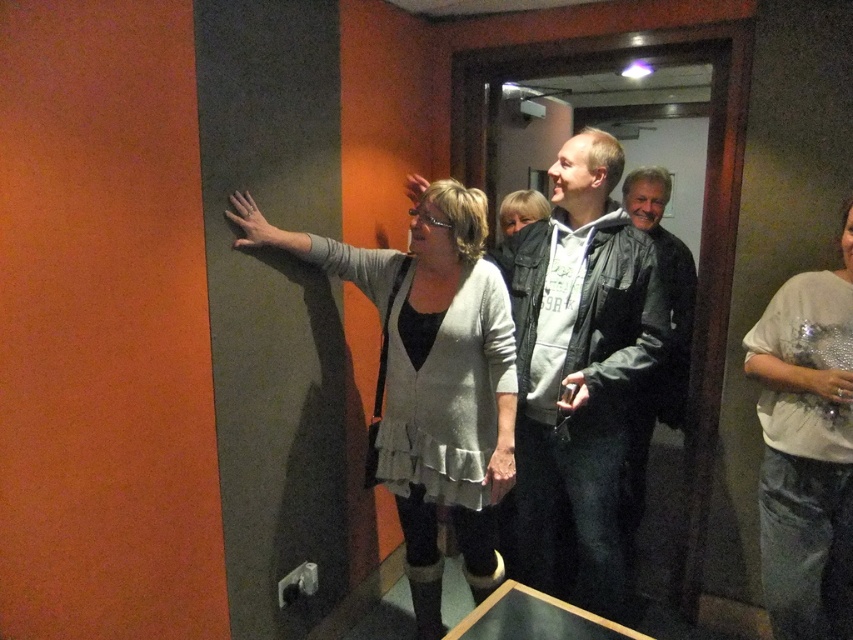
Is gray hoodie at center bigger than sparkly silver top at right?

Yes.

Which is more to the right, gray hoodie at center or sparkly silver top at right?

sparkly silver top at right

Who is more forward, (572, 420) or (820, 602)?

Point (820, 602) is in front.

The image size is (853, 640). What are the coordinates of `gray hoodie at center` in the screenshot? It's located at (579, 378).

Between gray hoodie at center and light gray textured sweater at center, which one has less height?

Standing shorter between the two is light gray textured sweater at center.

How far apart are gray hoodie at center and light gray textured sweater at center?

A distance of 12.88 inches exists between gray hoodie at center and light gray textured sweater at center.

Is point (532, 236) positioned before point (439, 477)?

No, (532, 236) is further to viewer.

At what (x,y) coordinates should I click in order to perform the action: click on gray hoodie at center. Please return your answer as a coordinate pair (x, y). Looking at the image, I should click on (579, 378).

Is light gray textured sweater at center above sparkly silver top at right?

Indeed, light gray textured sweater at center is positioned over sparkly silver top at right.

Locate an element on the screen. The image size is (853, 640). light gray textured sweater at center is located at coordinates (431, 378).